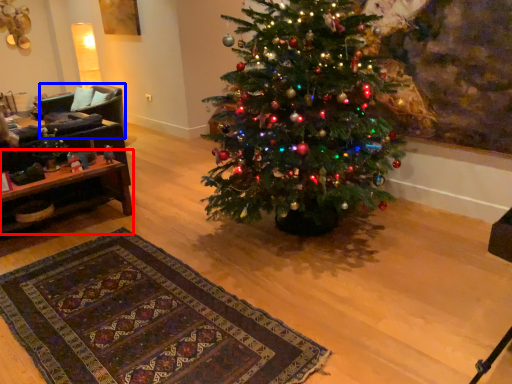
Question: Among these objects, which one is nearest to the camera, table (highlighted by a red box) or armchair (highlighted by a blue box)?

Choices:
 (A) table
 (B) armchair

Answer: (A)